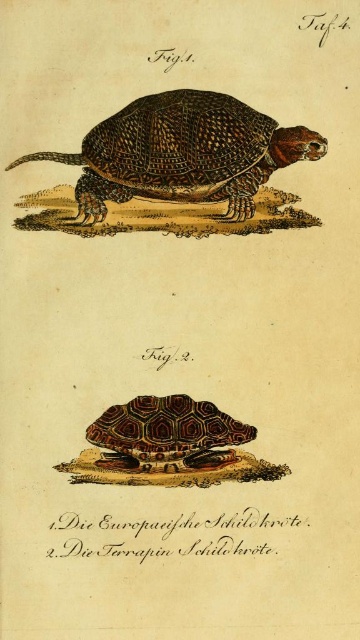
Looking at this image, you are a researcher examining the turtle illustration in the book. The turtle has a brown textured shell at center. If your eyes are 1.5 meters above the ground, can you see the entire shell without moving your head?

The brown textured shell at center is positioned 1.17 meters away from the viewer. Since the researcher is 1.5 meters tall, they can comfortably see the entire shell without needing to move their head as the distance is within a typical viewing range.